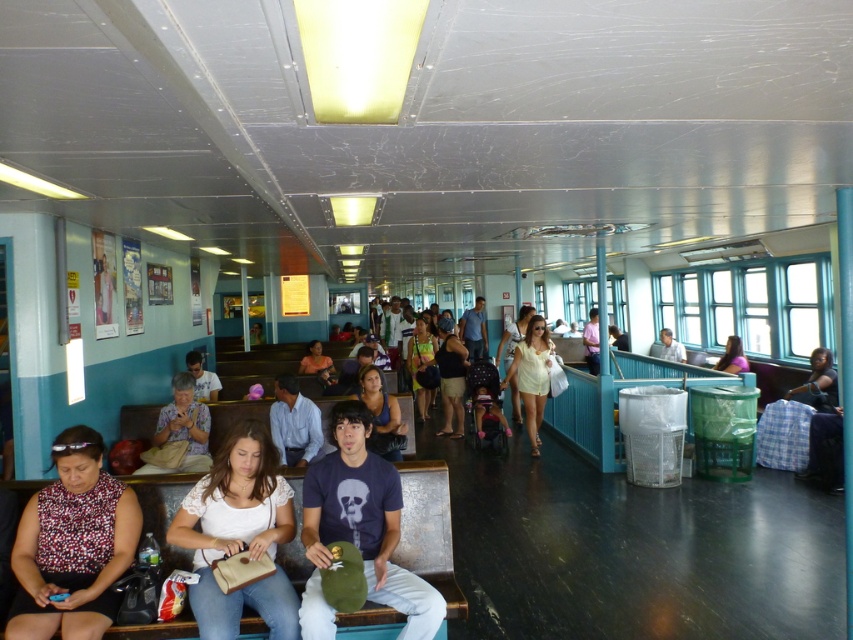
You are a passenger on a ferry and you see a printed fabric blouse at lower left and a light blue shirt at center. Which clothing item is closer to the floor?

The printed fabric blouse at lower left is positioned under the light blue shirt at center, so it is closer to the floor.

You are a passenger on the ferry and you see the pink fabric shirt at upper right and the light blue shirt at center. Which shirt is closer to the ceiling?

The pink fabric shirt at upper right is positioned under the light blue shirt at center, so the light blue shirt at center is closer to the ceiling.

You are a passenger on a ferry and you see a printed fabric blouse at lower left and a light blue shirt at center. Which clothing item is positioned higher up in the image?

The printed fabric blouse at lower left is much taller as light blue shirt at center, so it is positioned higher up in the image.